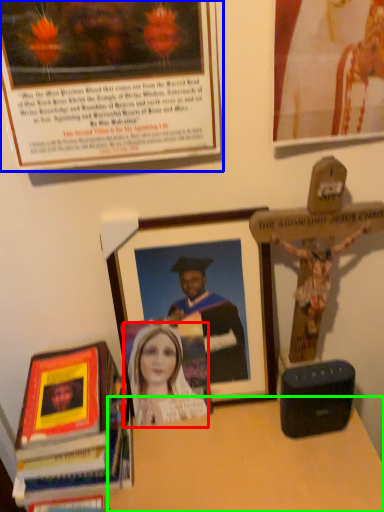
Question: Which object is the farthest from woman (highlighted by a red box)? Choose among these: picture frame (highlighted by a blue box) or table (highlighted by a green box).

Choices:
 (A) picture frame
 (B) table

Answer: (A)